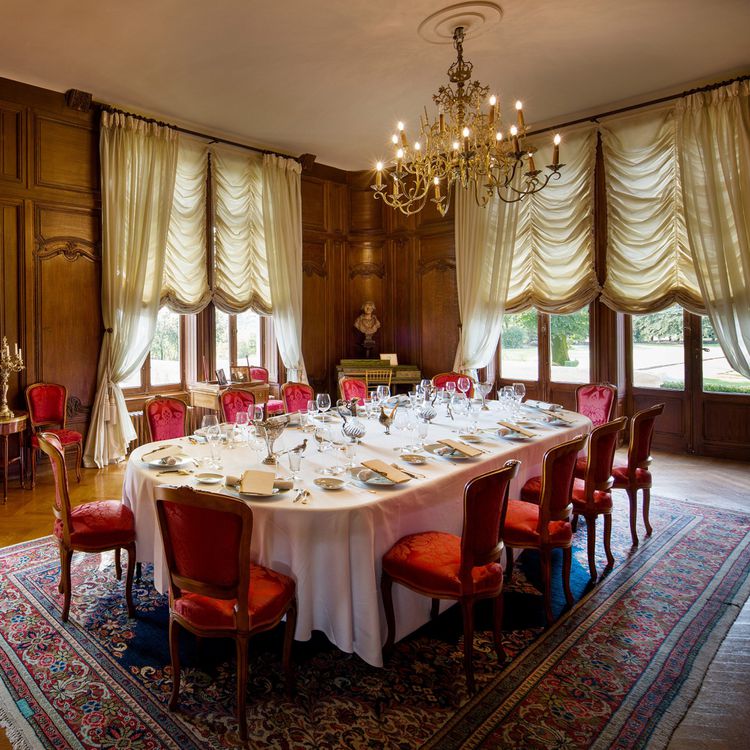
Locate an element on the screen. plate is located at coordinates (393, 477).